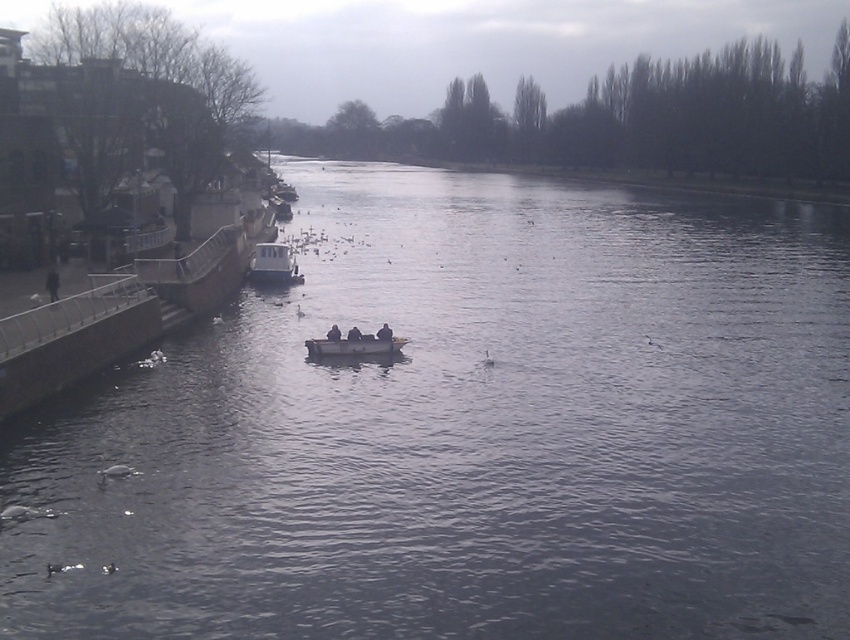
You are standing on the concrete embankment with the metal railing on the left side of the image. You see the smooth wooden boat at center and the white matte duck at lower left. Which object is located to the right of the other?

The smooth wooden boat at center is positioned on the right side of the white matte duck at lower left.

You are standing on the pathway near the concrete embankment and see both the smooth wooden boat at center and the dark brown wooden boat at center on the river. Which boat would appear closer to you?

The smooth wooden boat at center is in front of the dark brown wooden boat at center, so it would appear closer to you.

You are a photographer trying to capture both the dark gray fabric jacket at center and the white matte duck at lower left in the same frame. Which object will appear larger in your photo?

The dark gray fabric jacket at center will appear larger in the photo because it is bigger than the white matte duck at lower left.